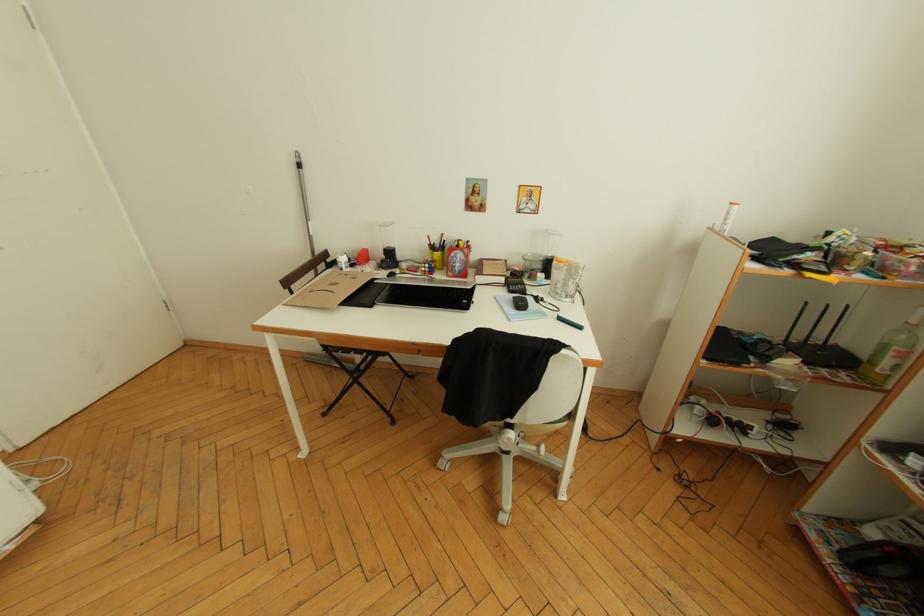
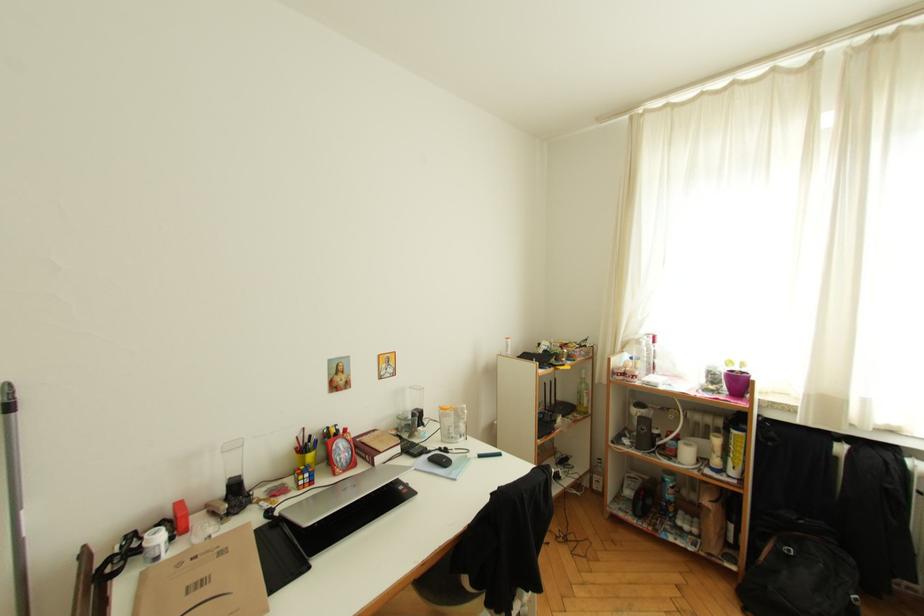
Question: The first image is from the beginning of the video and the second image is from the end. How did the camera likely rotate when shooting the video?

Choices:
 (A) Left
 (B) Right
 (C) Up
 (D) Down

Answer: (B)